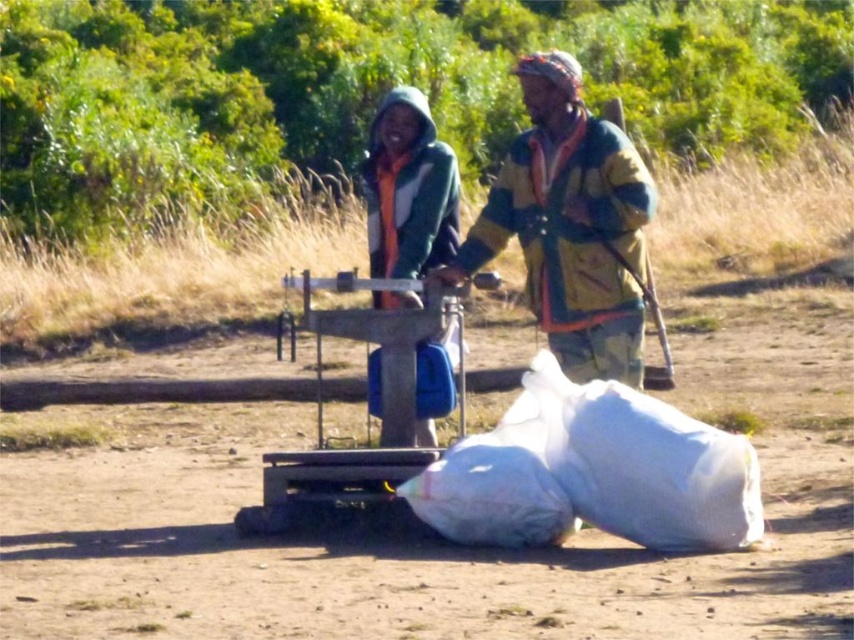
Does white plastic sack at lower right appear over multicolored fabric jacket at center?

Actually, white plastic sack at lower right is below multicolored fabric jacket at center.

This screenshot has width=854, height=640. What do you see at coordinates (592, 472) in the screenshot?
I see `white plastic sack at lower right` at bounding box center [592, 472].

Locate an element on the screen. Image resolution: width=854 pixels, height=640 pixels. white plastic sack at lower right is located at coordinates (592, 472).

Is point (531, 452) positioned after point (401, 138)?

That is False.

Who is more forward, (547, 486) or (390, 259)?

Point (547, 486) is more forward.

In order to click on white plastic sack at lower right in this screenshot , I will do `click(592, 472)`.

Between point (595, 243) and point (436, 156), which one is positioned in front?

Point (595, 243)

Is point (601, 124) less distant than point (443, 227)?

Yes, it is in front of point (443, 227).

Who is more forward, (582, 317) or (422, 422)?

Positioned in front is point (582, 317).

At what (x,y) coordinates should I click in order to perform the action: click on multicolored fabric jacket at center. Please return your answer as a coordinate pair (x, y). Looking at the image, I should click on (570, 225).